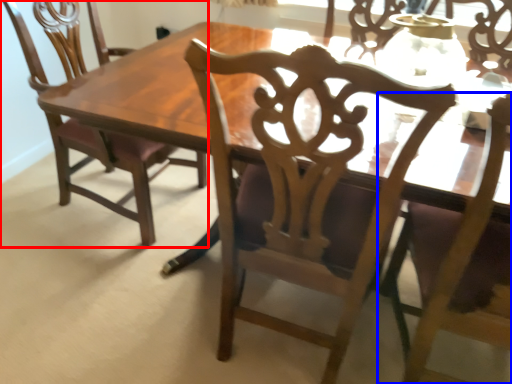
Question: Which object is closer to the camera taking this photo, chair (highlighted by a red box) or chair (highlighted by a blue box)?

Choices:
 (A) chair
 (B) chair

Answer: (B)